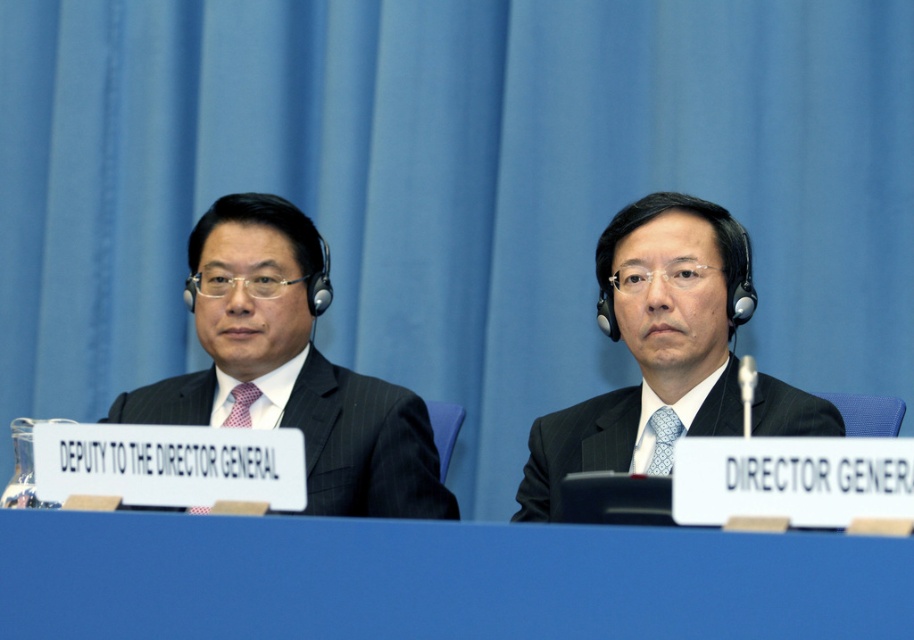
Which is below, dark gray pinstripe suit at left or blue printed tie at center?

blue printed tie at center

Where is `dark gray pinstripe suit at left`? Image resolution: width=914 pixels, height=640 pixels. dark gray pinstripe suit at left is located at coordinates (364, 445).

Who is more forward, [112,630] or [657,454]?

Positioned in front is point [112,630].

Image resolution: width=914 pixels, height=640 pixels. What do you see at coordinates (437, 579) in the screenshot? I see `blue plastic table at center` at bounding box center [437, 579].

Locate an element on the screen. The image size is (914, 640). blue plastic table at center is located at coordinates (437, 579).

Is blue plastic table at center to the left of red checkered tie at left from the viewer's perspective?

Incorrect, blue plastic table at center is not on the left side of red checkered tie at left.

Measure the distance between blue plastic table at center and camera.

The distance of blue plastic table at center from camera is 4.38 feet.

At what (x,y) coordinates should I click in order to perform the action: click on blue plastic table at center. Please return your answer as a coordinate pair (x, y). Image resolution: width=914 pixels, height=640 pixels. Looking at the image, I should click on (437, 579).